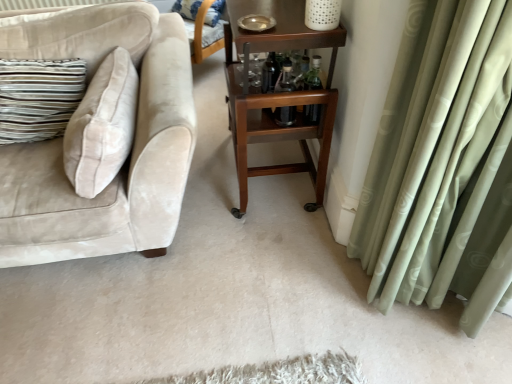
Where is `beige velvet couch at left`? Image resolution: width=512 pixels, height=384 pixels. beige velvet couch at left is located at coordinates (101, 137).

This screenshot has height=384, width=512. Describe the element at coordinates (286, 77) in the screenshot. I see `transparent glass bottle at center, the 2th bottle positioned from the right` at that location.

You are a GUI agent. You are given a task and a screenshot of the screen. Output one action in this format:
    pyautogui.click(x=<x>, y=<y>)
    Task: Click on the striped fabric pillow at upper center
    
    Given the screenshot: What is the action you would take?
    pyautogui.click(x=187, y=8)

Consider the image. Measure the distance between clear glass bottles at center, marked as the 1th bottle in a right-to-left arrangement, and camera.

They are 1.58 meters apart.

Measure the distance between point (x=271, y=50) and camera.

Point (x=271, y=50) is 4.86 feet from camera.

Where is `beige velvet couch at left`? beige velvet couch at left is located at coordinates (101, 137).

What's the angular difference between wooden rolling cart at center and transparent glass bottle at center, acting as the first bottle starting from the left,'s facing directions?

wooden rolling cart at center and transparent glass bottle at center, acting as the first bottle starting from the left, are facing 1.57 degrees away from each other.

Which is less distant, (320,191) or (283,121)?

Positioned in front is point (283,121).

Is wooden rolling cart at center wider than transparent glass bottle at center, acting as the first bottle starting from the left?

Yes, wooden rolling cart at center is wider than transparent glass bottle at center, acting as the first bottle starting from the left.

Considering the relative sizes of wooden rolling cart at center and transparent glass bottle at center, acting as the first bottle starting from the left, in the image provided, is wooden rolling cart at center smaller than transparent glass bottle at center, acting as the first bottle starting from the left,?

Incorrect, wooden rolling cart at center is not smaller in size than transparent glass bottle at center, acting as the first bottle starting from the left.

Considering the sizes of transparent glass bottle at center, the 2th bottle positioned from the right, and wooden rolling cart at center in the image, is transparent glass bottle at center, the 2th bottle positioned from the right, taller or shorter than wooden rolling cart at center?

In the image, transparent glass bottle at center, the 2th bottle positioned from the right, appears to be shorter than wooden rolling cart at center.

Is transparent glass bottle at center, acting as the first bottle starting from the left, inside the boundaries of wooden rolling cart at center, or outside?

transparent glass bottle at center, acting as the first bottle starting from the left, can be found inside wooden rolling cart at center.

Between transparent glass bottle at center, acting as the first bottle starting from the left, and wooden rolling cart at center, which one has larger width?

Wider between the two is wooden rolling cart at center.

Considering the positions of objects transparent glass bottle at center, the 2th bottle positioned from the right, and wooden rolling cart at center in the image provided, who is in front, transparent glass bottle at center, the 2th bottle positioned from the right, or wooden rolling cart at center?

wooden rolling cart at center is closer to the camera.

Which is in front, clear glass bottles at center, arranged as the second bottle when viewed from the left, or beige velvet couch at left?

beige velvet couch at left is closer to the camera.

Considering the sizes of objects clear glass bottles at center, marked as the 1th bottle in a right-to-left arrangement, and beige velvet couch at left in the image provided, who is smaller, clear glass bottles at center, marked as the 1th bottle in a right-to-left arrangement, or beige velvet couch at left?

With smaller size is clear glass bottles at center, marked as the 1th bottle in a right-to-left arrangement.

Which is behind, point (311, 119) or point (76, 38)?

Point (76, 38)

Looking at this image, from the image's perspective, does transparent glass bottle at center, acting as the first bottle starting from the left, appear higher than striped fabric pillow at upper center?

No, from the image's perspective, transparent glass bottle at center, acting as the first bottle starting from the left, is not above striped fabric pillow at upper center.

Identify the location of the 2nd bottle in front when counting from the striped fabric pillow at upper center. (286, 77).

Does point (295, 117) come farther from viewer compared to point (175, 8)?

No, (295, 117) is closer to viewer.

Is transparent glass bottle at center, acting as the first bottle starting from the left, oriented away from striped fabric pillow at upper center?

transparent glass bottle at center, acting as the first bottle starting from the left, does not have its back to striped fabric pillow at upper center.

Can you confirm if clear glass bottles at center, marked as the 1th bottle in a right-to-left arrangement, is smaller than transparent glass bottle at center, acting as the first bottle starting from the left?

No.

Is clear glass bottles at center, arranged as the second bottle when viewed from the left, aimed at transparent glass bottle at center, the 2th bottle positioned from the right?

Yes, clear glass bottles at center, arranged as the second bottle when viewed from the left, is oriented towards transparent glass bottle at center, the 2th bottle positioned from the right.

Who is taller, clear glass bottles at center, arranged as the second bottle when viewed from the left, or transparent glass bottle at center, the 2th bottle positioned from the right?

Standing taller between the two is clear glass bottles at center, arranged as the second bottle when viewed from the left.

Can you confirm if clear glass bottles at center, marked as the 1th bottle in a right-to-left arrangement, is thinner than transparent glass bottle at center, acting as the first bottle starting from the left?

Indeed, clear glass bottles at center, marked as the 1th bottle in a right-to-left arrangement, has a lesser width compared to transparent glass bottle at center, acting as the first bottle starting from the left.

Can you see clear glass bottles at center, marked as the 1th bottle in a right-to-left arrangement, touching wooden rolling cart at center?

clear glass bottles at center, marked as the 1th bottle in a right-to-left arrangement, is not next to wooden rolling cart at center, and they're not touching.

Which object is wider, clear glass bottles at center, marked as the 1th bottle in a right-to-left arrangement, or wooden rolling cart at center?

wooden rolling cart at center.

Relative to wooden rolling cart at center, is clear glass bottles at center, marked as the 1th bottle in a right-to-left arrangement, in front or behind?

Visually, clear glass bottles at center, marked as the 1th bottle in a right-to-left arrangement, is located behind wooden rolling cart at center.

Is wooden rolling cart at center a part of clear glass bottles at center, marked as the 1th bottle in a right-to-left arrangement?

No, wooden rolling cart at center is located outside of clear glass bottles at center, marked as the 1th bottle in a right-to-left arrangement.

Find the location of `pillow above the clear glass bottles at center, arranged as the second bottle when viewed from the left (from the image's perspective)`. pillow above the clear glass bottles at center, arranged as the second bottle when viewed from the left (from the image's perspective) is located at coordinates (187, 8).

Is clear glass bottles at center, marked as the 1th bottle in a right-to-left arrangement, located outside striped fabric pillow at upper center?

Yes, clear glass bottles at center, marked as the 1th bottle in a right-to-left arrangement, is located beyond the bounds of striped fabric pillow at upper center.

In the scene shown: From the image's perspective, is clear glass bottles at center, arranged as the second bottle when viewed from the left, located beneath striped fabric pillow at upper center?

Yes, from the image's perspective, clear glass bottles at center, arranged as the second bottle when viewed from the left, is beneath striped fabric pillow at upper center.

At what (x,y) coordinates should I click in order to perform the action: click on the 1st bottle to the right of the wooden rolling cart at center, starting your count from the anchor. Please return your answer as a coordinate pair (x, y). Looking at the image, I should click on (286, 77).

From the image's perspective, count 2nd bottles downward from the wooden rolling cart at center and point to it. Please provide its 2D coordinates.

[(286, 77)]

When comparing their distances from beige velvet couch at left, does striped fabric pillow at upper center or transparent glass bottle at center, acting as the first bottle starting from the left, seem further?

striped fabric pillow at upper center is positioned further to the anchor beige velvet couch at left.

In the scene shown: Looking at the image, which one is located further to clear glass bottles at center, arranged as the second bottle when viewed from the left, wooden rolling cart at center or beige velvet couch at left?

Among the two, beige velvet couch at left is located further to clear glass bottles at center, arranged as the second bottle when viewed from the left.

In the scene shown: Looking at the image, which one is located closer to clear glass bottles at center, marked as the 1th bottle in a right-to-left arrangement, striped fabric pillow at upper center or wooden rolling cart at center?

Based on the image, wooden rolling cart at center appears to be nearer to clear glass bottles at center, marked as the 1th bottle in a right-to-left arrangement.

Which object lies further to the anchor point beige velvet couch at left, clear glass bottles at center, marked as the 1th bottle in a right-to-left arrangement, or striped fabric pillow at upper center?

striped fabric pillow at upper center lies further to beige velvet couch at left than the other object.

Looking at the image, which one is located further to transparent glass bottle at center, the 2th bottle positioned from the right, wooden rolling cart at center or striped fabric pillow at upper center?

Among the two, striped fabric pillow at upper center is located further to transparent glass bottle at center, the 2th bottle positioned from the right.

Looking at the image, which one is located further to transparent glass bottle at center, acting as the first bottle starting from the left, striped fabric pillow at upper center or beige velvet couch at left?

striped fabric pillow at upper center.

Which object lies nearer to the anchor point transparent glass bottle at center, acting as the first bottle starting from the left, clear glass bottles at center, arranged as the second bottle when viewed from the left, or beige velvet couch at left?

The object closer to transparent glass bottle at center, acting as the first bottle starting from the left, is clear glass bottles at center, arranged as the second bottle when viewed from the left.

Considering their positions, is striped fabric pillow at upper center positioned further to transparent glass bottle at center, the 2th bottle positioned from the right, than wooden rolling cart at center?

striped fabric pillow at upper center.

This screenshot has width=512, height=384. I want to click on table between beige velvet couch at left and striped fabric pillow at upper center along the z-axis, so click(277, 94).

What are the coordinates of `table between beige velvet couch at left and clear glass bottles at center, marked as the 1th bottle in a right-to-left arrangement` in the screenshot? It's located at (277, 94).

This screenshot has height=384, width=512. I want to click on bottle positioned between wooden rolling cart at center and clear glass bottles at center, arranged as the second bottle when viewed from the left, from near to far, so click(286, 77).

Where is `table between beige velvet couch at left and transparent glass bottle at center, acting as the first bottle starting from the left`? This screenshot has height=384, width=512. table between beige velvet couch at left and transparent glass bottle at center, acting as the first bottle starting from the left is located at coordinates pyautogui.click(x=277, y=94).